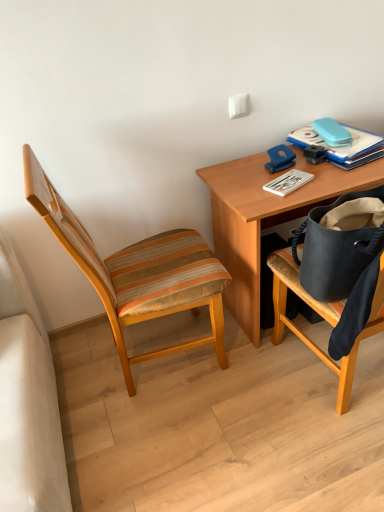
Question: Considering the relative sizes of white matte paperback book at upper right, the second paperback book when ordered from right to left, and blue hardcover book at upper right, placed as the 1th paperback book when sorted from right to left, in the image provided, is white matte paperback book at upper right, the second paperback book when ordered from right to left, smaller than blue hardcover book at upper right, placed as the 1th paperback book when sorted from right to left,?

Choices:
 (A) yes
 (B) no

Answer: (A)

Question: Is blue hardcover book at upper right, placed as the second paperback book when sorted from left to right, located within white matte paperback book at upper right, the second paperback book when ordered from right to left?

Choices:
 (A) no
 (B) yes

Answer: (A)

Question: Is white matte paperback book at upper right, positioned as the first paperback book in left-to-right order, to the right of blue hardcover book at upper right, the first paperback book from the top, from the viewer's perspective?

Choices:
 (A) no
 (B) yes

Answer: (A)

Question: Is white matte paperback book at upper right, the second paperback book when ordered from right to left, positioned with its back to blue hardcover book at upper right, placed as the second paperback book when sorted from left to right?

Choices:
 (A) no
 (B) yes

Answer: (A)

Question: Does white matte paperback book at upper right, the second paperback book when ordered from right to left, have a lesser height compared to blue hardcover book at upper right, arranged as the 2th paperback book when ordered from the bottom?

Choices:
 (A) yes
 (B) no

Answer: (A)

Question: Does white matte paperback book at upper right, which is the 2th paperback book from top to bottom, come in front of blue hardcover book at upper right, placed as the 1th paperback book when sorted from right to left?

Choices:
 (A) yes
 (B) no

Answer: (A)

Question: Is wooden desk at upper right a part of blue hardcover book at upper right, placed as the second paperback book when sorted from left to right?

Choices:
 (A) no
 (B) yes

Answer: (A)

Question: Is blue hardcover book at upper right, the first paperback book from the top, far away from wooden desk at upper right?

Choices:
 (A) yes
 (B) no

Answer: (B)

Question: From the image's perspective, does blue hardcover book at upper right, arranged as the 2th paperback book when ordered from the bottom, appear higher than wooden desk at upper right?

Choices:
 (A) yes
 (B) no

Answer: (A)

Question: Is blue hardcover book at upper right, the first paperback book from the top, smaller than wooden desk at upper right?

Choices:
 (A) no
 (B) yes

Answer: (B)

Question: Is blue hardcover book at upper right, arranged as the 2th paperback book when ordered from the bottom, further to the viewer compared to wooden desk at upper right?

Choices:
 (A) no
 (B) yes

Answer: (B)

Question: Is blue hardcover book at upper right, arranged as the 2th paperback book when ordered from the bottom, directly adjacent to wooden desk at upper right?

Choices:
 (A) no
 (B) yes

Answer: (A)

Question: Are white matte paperback book at upper right, which is the first paperback book from bottom to top, and wooden desk at upper right making contact?

Choices:
 (A) yes
 (B) no

Answer: (B)